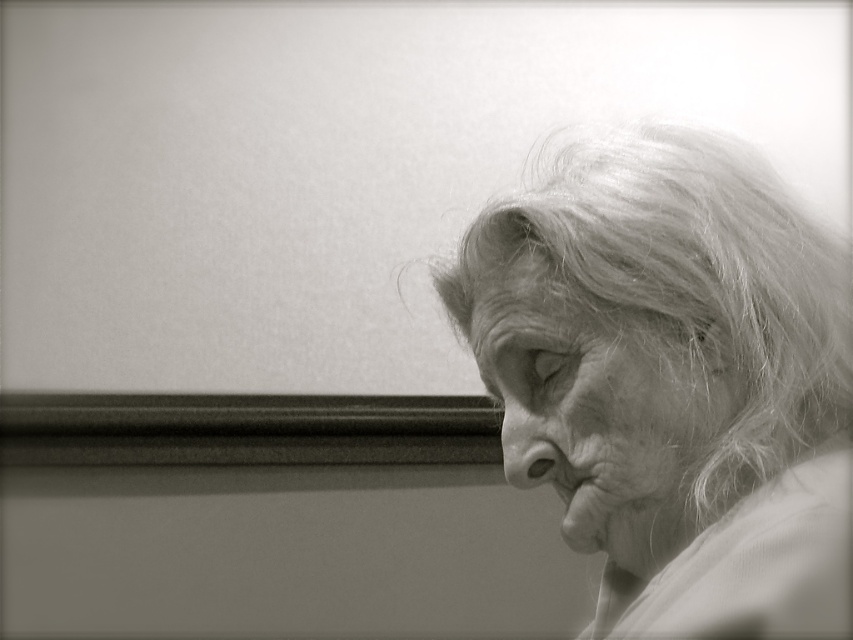
In the black and white photograph, you see the smooth skin face at center and the smooth skin nose at center. Which one is located to the right side?

The smooth skin face at center is positioned on the right side of the smooth skin nose at center, so the smooth skin face at center is located to the right side.

You are an artist analyzing this black and white photograph. You notice two points marked in the image. The first point is at coordinate point (717, 554) and the second is at point (496, 292). Which of these two points appears closer to you in the image?

Point (717, 554) is closer to the viewer than point (496, 292).

Based on the photo, based on the scene description, where exactly is the smooth skin face at center located in terms of coordinates?

The smooth skin face at center is located at coordinates point (596, 410).